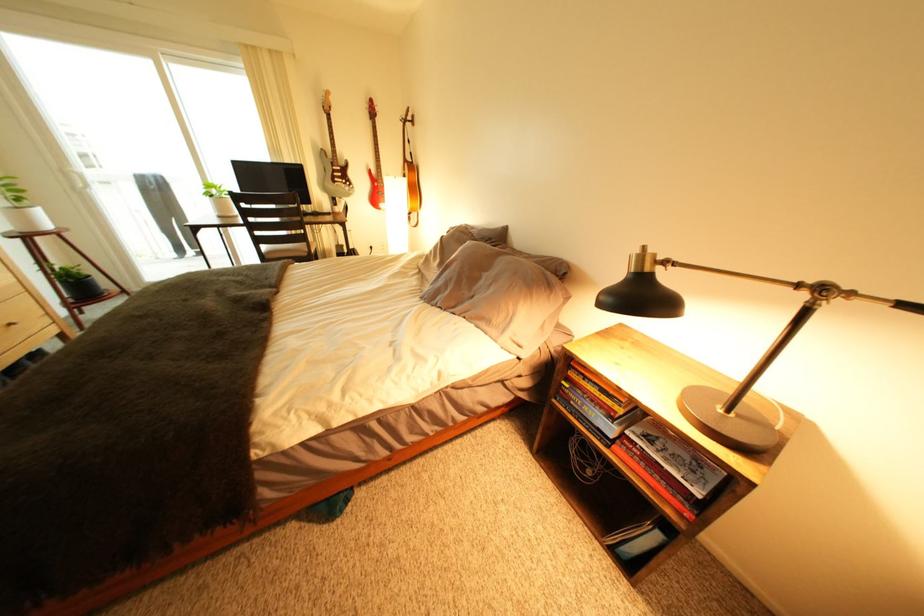
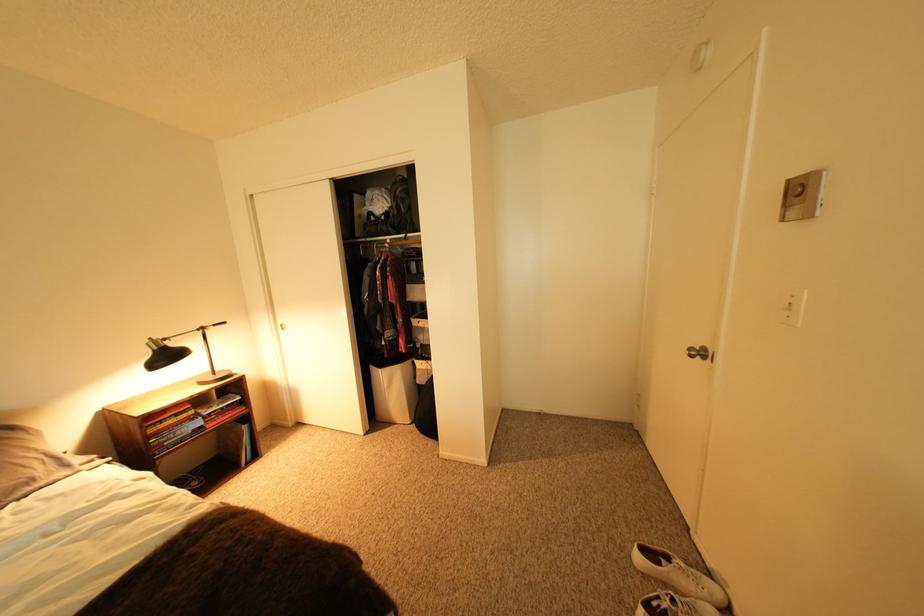
Find the pixel in the second image that matches (594,407) in the first image.

(188, 435)